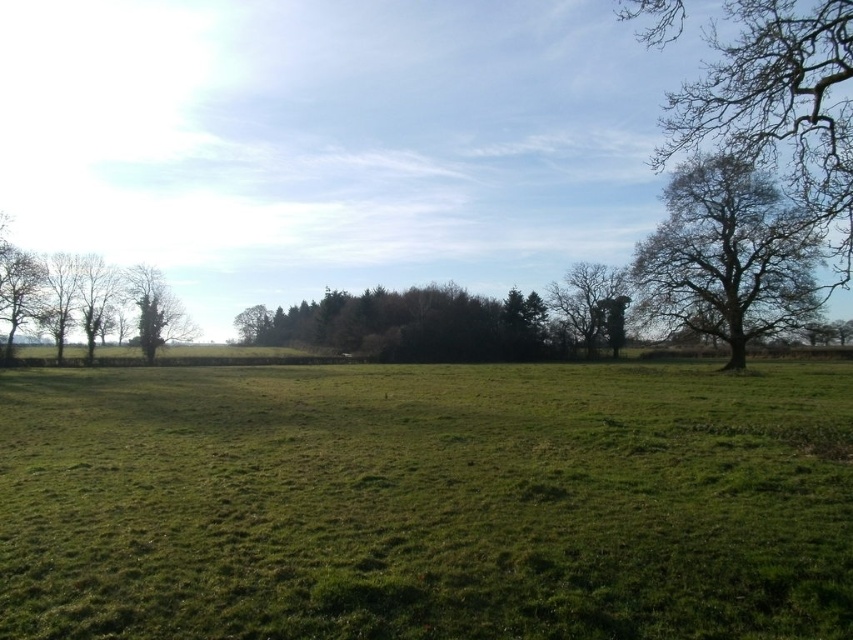
You are standing on the green grassy field at center and want to walk towards the green leafy tree at right. Which direction should you head to ensure you stay on the field while approaching the tree?

Since the green grassy field at center is positioned under the green leafy tree at right, you should head towards the right direction while staying on the field to approach the tree.

In the scene shown: You are standing at the center of the field in the rural landscape. There is a point marked at coordinates point (x=779, y=104). Based on the scene description, can you determine what is located at those coordinates?

The point (x=779, y=104) is located on bare branches at upper right.